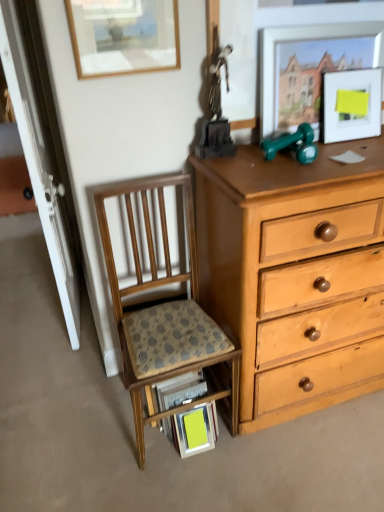
Where is `vacant area on top of matte silver picture frame at upper right, which ranks as the 2th picture frame in left-to-right order (from a real-world perspective)`? vacant area on top of matte silver picture frame at upper right, which ranks as the 2th picture frame in left-to-right order (from a real-world perspective) is located at coordinates (326, 20).